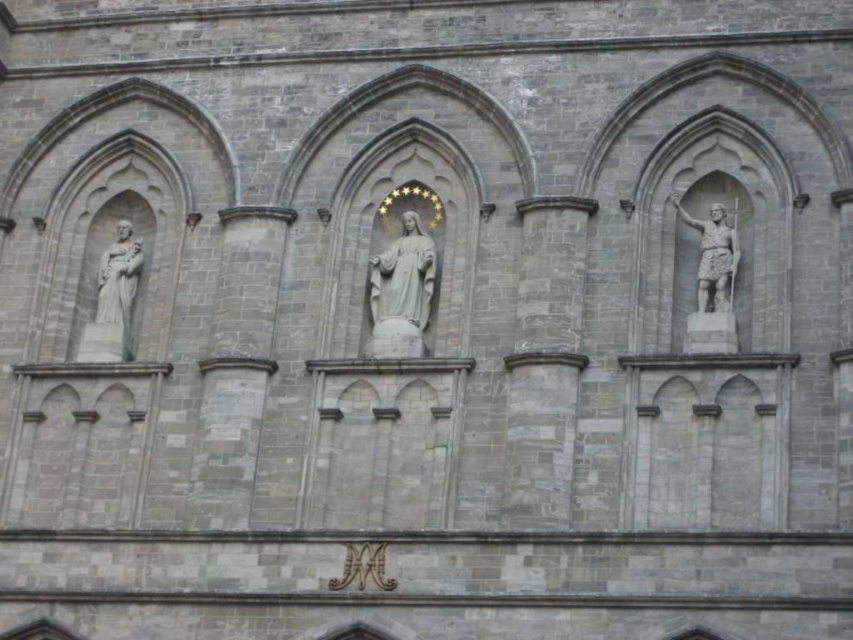
Question: Is polished bronze statue at upper right thinner than white marble statue at left?

Choices:
 (A) yes
 (B) no

Answer: (A)

Question: Estimate the real-world distances between objects in this image. Which object is closer to the white marble statue at left?

Choices:
 (A) polished bronze statue at upper right
 (B) white marble statue at center

Answer: (B)

Question: Based on their relative distances, which object is nearer to the polished bronze statue at upper right?

Choices:
 (A) white marble statue at center
 (B) white marble statue at left

Answer: (A)

Question: Which object is closer to the camera taking this photo?

Choices:
 (A) polished bronze statue at upper right
 (B) white marble statue at left
 (C) white marble statue at center

Answer: (A)

Question: Is polished bronze statue at upper right wider than white marble statue at left?

Choices:
 (A) no
 (B) yes

Answer: (A)

Question: Can you confirm if polished bronze statue at upper right is wider than white marble statue at left?

Choices:
 (A) no
 (B) yes

Answer: (A)